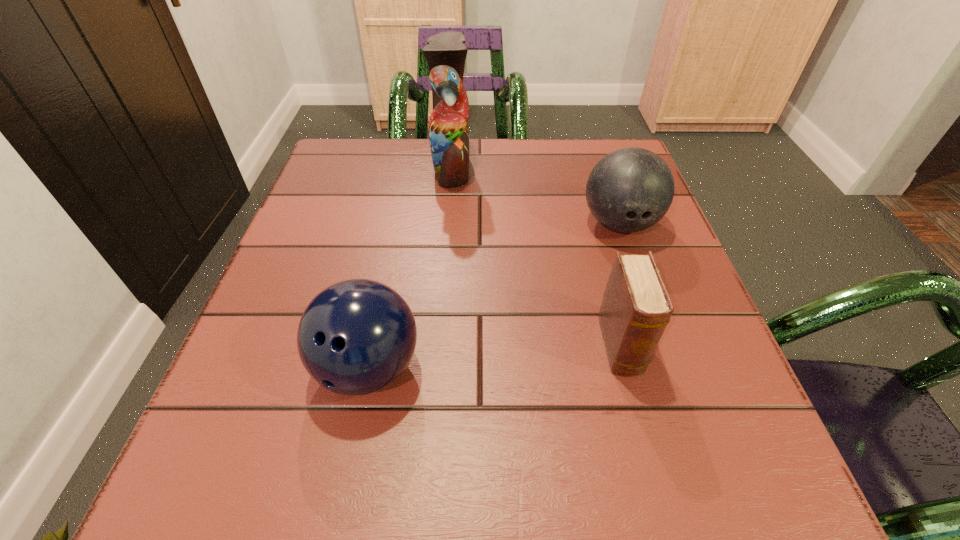
Image resolution: width=960 pixels, height=540 pixels. Find the location of `object that is at the left edge`. object that is at the left edge is located at coordinates (356, 337).

Find the location of `bowling ball at the right edge`. bowling ball at the right edge is located at coordinates (630, 189).

I want to click on diary that is positioned at the right edge, so click(636, 307).

This screenshot has height=540, width=960. In the image, there is a desktop. Find the location of `blank space at the far edge`. blank space at the far edge is located at coordinates (558, 160).

You are a GUI agent. You are given a task and a screenshot of the screen. Output one action in this format:
    pyautogui.click(x=<x>, y=<y>)
    Task: Click on the free space at the left edge
    The height and width of the screenshot is (540, 960).
    Given the screenshot: What is the action you would take?
    pyautogui.click(x=328, y=241)

In the image, there is a desktop. At what (x,y) coordinates should I click in order to perform the action: click on vacant space at the right edge. Please return your answer as a coordinate pair (x, y). The height and width of the screenshot is (540, 960). Looking at the image, I should click on (707, 388).

Where is `free space at the near left corner of the desktop`? Image resolution: width=960 pixels, height=540 pixels. free space at the near left corner of the desktop is located at coordinates (301, 451).

Locate an element on the screen. vacant area that lies between the nearer bowling ball and the right bowling ball is located at coordinates tap(494, 296).

Locate an element on the screen. vacant space that is in between the parrot and the diary is located at coordinates (536, 255).

Locate an element on the screen. vacant space in between the farthest object and the right bowling ball is located at coordinates (536, 194).